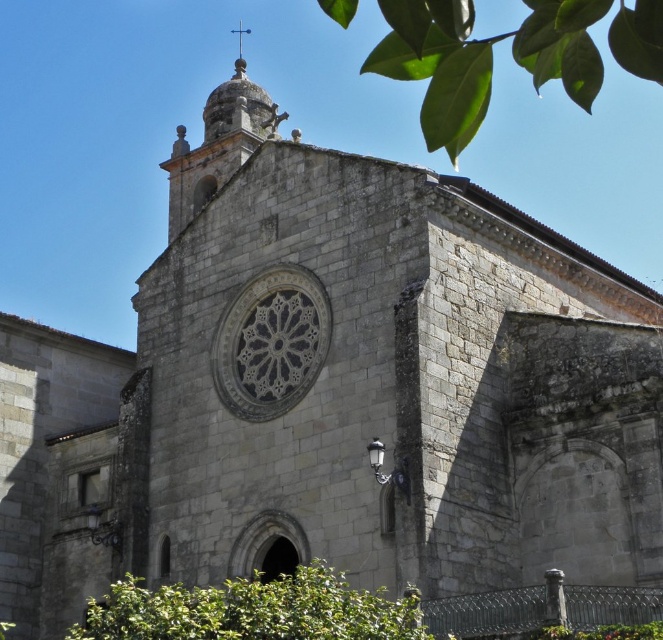
Question: Is green leafy tree at upper center smaller than carved stone rose window at center?

Choices:
 (A) yes
 (B) no

Answer: (B)

Question: Which object is positioned closest to the green leafy bush at lower center?

Choices:
 (A) green leafy tree at upper center
 (B) carved stone rose window at center

Answer: (B)

Question: Estimate the real-world distances between objects in this image. Which object is closer to the carved stone rose window at center?

Choices:
 (A) green leafy tree at upper center
 (B) green leafy bush at lower center

Answer: (B)

Question: From the image, what is the correct spatial relationship of green leafy tree at upper center in relation to carved stone rose window at center?

Choices:
 (A) right
 (B) left

Answer: (A)

Question: Which object is positioned farthest from the green leafy tree at upper center?

Choices:
 (A) green leafy bush at lower center
 (B) carved stone rose window at center

Answer: (B)

Question: Can you confirm if green leafy bush at lower center is thinner than carved stone rose window at center?

Choices:
 (A) yes
 (B) no

Answer: (B)